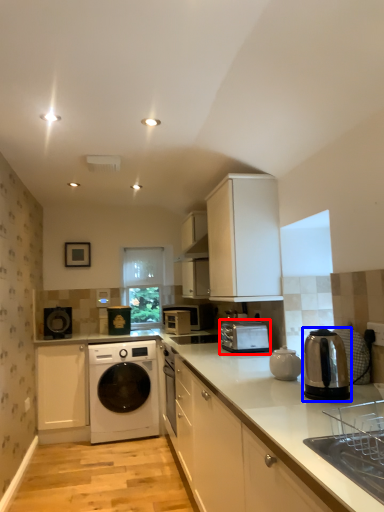
Question: Which point is closer to the camera, home appliance (highlighted by a red box) or home appliance (highlighted by a blue box)?

Choices:
 (A) home appliance
 (B) home appliance

Answer: (B)